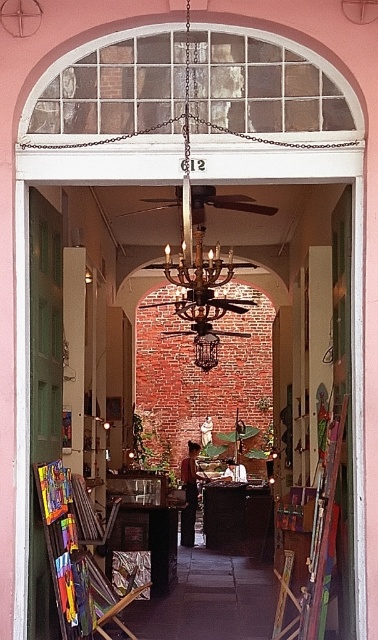
You are an artist carrying a 3.5 meter long canvas. You are standing at the wooden easel at left and want to move it to the bronze textured chandelier at center. Can you move the canvas horizontally without bending it in this space?

The distance between wooden easel at left and bronze textured chandelier at center is 4.04 meters, which is longer than the 3.5 meter canvas. Therefore, you can move the canvas horizontally without bending it in this space.

You are an interior designer assessing the height requirements for a new ceiling fixture. You observe the wooden easel at left and the bronze textured chandelier at center in the shop. Which object is shorter?

The wooden easel at left is shorter than the bronze textured chandelier at center.

Consider the image. You are an artist entering the quaint shop and see the wooden easel at left and the bronze textured chandelier at center. Which object is closer to the entrance?

The wooden easel at left is closer to the entrance because it is positioned on the left side of the bronze textured chandelier at center, which is further inward.